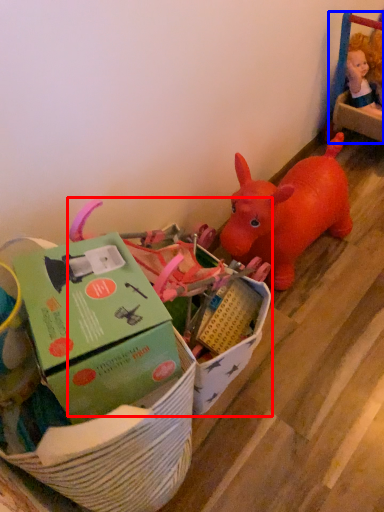
Question: Which object is further to the camera taking this photo, toy (highlighted by a red box) or toy (highlighted by a blue box)?

Choices:
 (A) toy
 (B) toy

Answer: (B)